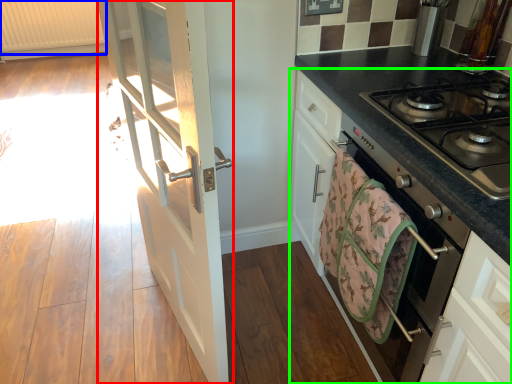
Question: Estimate the real-world distances between objects in this image. Which object is closer to door (highlighted by a red box), radiator (highlighted by a blue box) or cabinetry (highlighted by a green box)?

Choices:
 (A) radiator
 (B) cabinetry

Answer: (B)